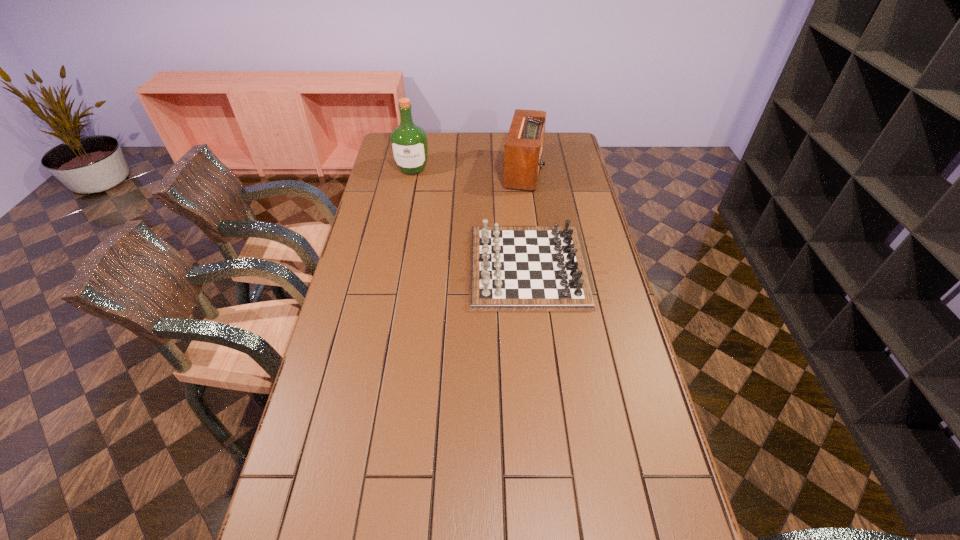
Find the location of a particular element. This screenshot has width=960, height=540. free point between the chessboard and the tallest object is located at coordinates (470, 218).

Find the location of `unoccupied area between the tallest object and the second shortest object`. unoccupied area between the tallest object and the second shortest object is located at coordinates (x=468, y=170).

Find the location of `free space between the tallest object and the second tallest object`. free space between the tallest object and the second tallest object is located at coordinates (468, 170).

You are a GUI agent. You are given a task and a screenshot of the screen. Output one action in this format:
    pyautogui.click(x=<x>, y=<y>)
    Task: Click on the empty space that is in between the radio receiver and the chessboard
    
    Given the screenshot: What is the action you would take?
    pyautogui.click(x=525, y=219)

Identify the location of vacant space that's between the liquor and the radio receiver. (468, 170).

Identify which object is located as the nearest to the shortest object. Please provide its 2D coordinates. Your answer should be formatted as a tuple, i.e. [(x, y)], where the tuple contains the x and y coordinates of a point satisfying the conditions above.

[(523, 150)]

This screenshot has width=960, height=540. I want to click on object that ranks as the second closest to the tallest object, so click(512, 268).

This screenshot has width=960, height=540. What are the coordinates of `free space that satisfies the following two spatial constraints: 1. on the front-facing side of the second shortest object; 2. on the left side of the tallest object` in the screenshot? It's located at (412, 171).

Find the location of `free space that satisfies the following two spatial constraints: 1. on the front-facing side of the radio receiver; 2. on the left side of the tallest object`. free space that satisfies the following two spatial constraints: 1. on the front-facing side of the radio receiver; 2. on the left side of the tallest object is located at coordinates (412, 171).